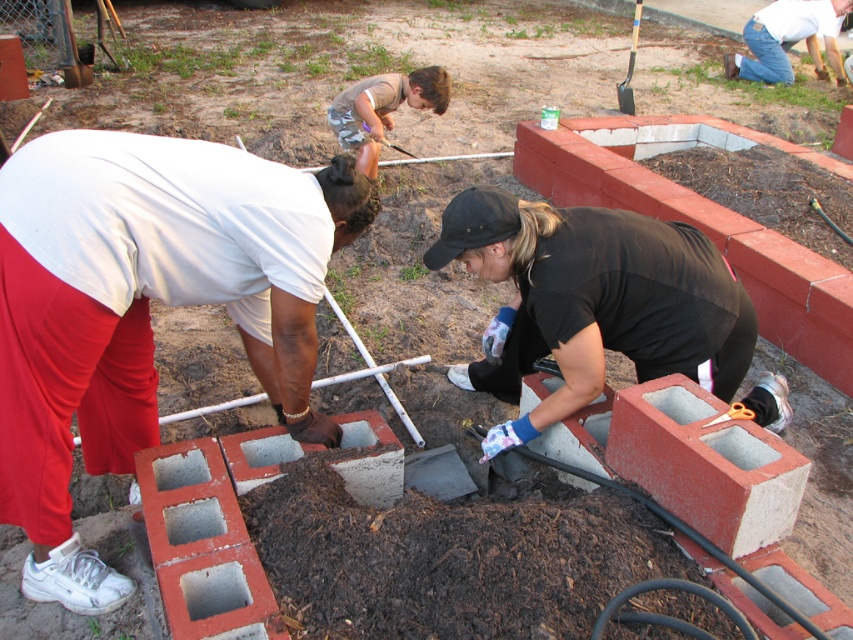
You are a construction worker observing the scene. You notice the matte white shirt at left and the wooden handle shovel at upper right. Which object is positioned higher in the image?

The wooden handle shovel at upper right is positioned higher than the matte white shirt at left in the image.

Looking at the construction scene of the community garden, where is the matte white shirt at left in relation to the wooden handle shovel at upper right?

The matte white shirt at left is positioned to the left of the wooden handle shovel at upper right.

You are a construction worker who needs to move the jeans at upper right and the wooden handle shovel at upper right to a storage area. Which item takes up more space when placed in the storage?

The wooden handle shovel at upper right takes up more space than the jeans at upper right because the jeans at upper right occupies less space than wooden handle shovel at upper right.